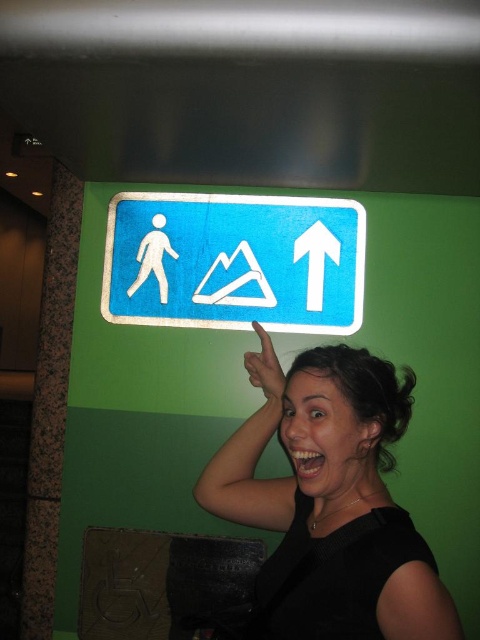
Question: Does blue plastic sign at upper center appear over white glossy arrow at upper center?

Choices:
 (A) yes
 (B) no

Answer: (A)

Question: Among these points, which one is farthest from the camera?

Choices:
 (A) (216, 304)
 (B) (319, 244)
 (C) (131, 220)
 (D) (370, 616)

Answer: (C)

Question: Estimate the real-world distances between objects in this image. Which object is farther from the black matte hair at upper right?

Choices:
 (A) blue plastic sign at upper center
 (B) white glossy arrow at upper center
 (C) white plastic arrow at upper center

Answer: (B)

Question: Can you confirm if black matte hair at upper right is thinner than blue plastic sign at upper center?

Choices:
 (A) yes
 (B) no

Answer: (A)

Question: Which point is closer to the camera taking this photo?

Choices:
 (A) (295, 285)
 (B) (332, 243)
 (C) (239, 276)

Answer: (A)

Question: Is black matte hair at upper right below white plastic arrow at upper center?

Choices:
 (A) yes
 (B) no

Answer: (A)